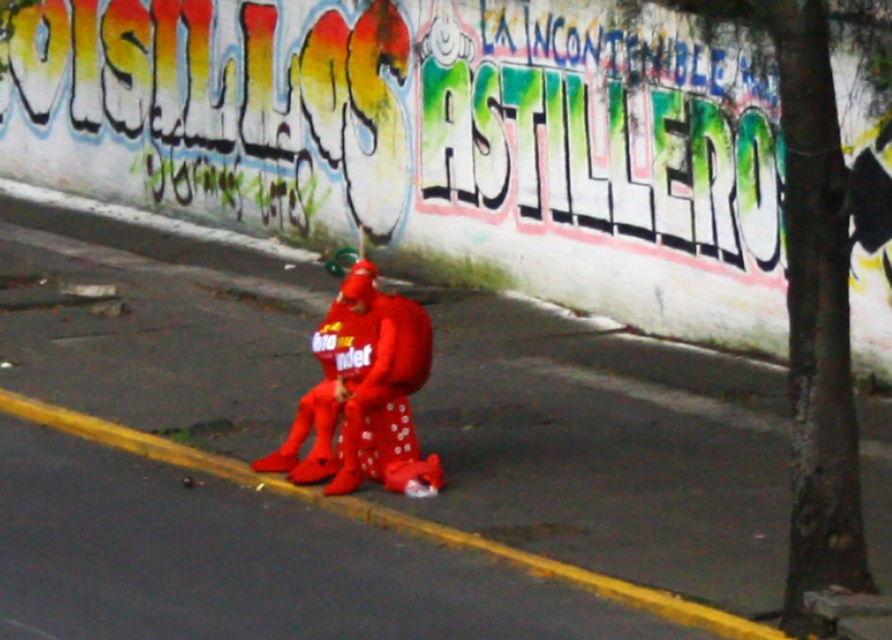
This screenshot has height=640, width=892. What do you see at coordinates (606, 448) in the screenshot? I see `matte red pavement at center` at bounding box center [606, 448].

Based on the photo, between matte red pavement at center and matte red costume at center, which one has more height?

With more height is matte red pavement at center.

The height and width of the screenshot is (640, 892). In order to click on matte red pavement at center in this screenshot , I will do `click(606, 448)`.

Find the location of `matte red pavement at center`. matte red pavement at center is located at coordinates (606, 448).